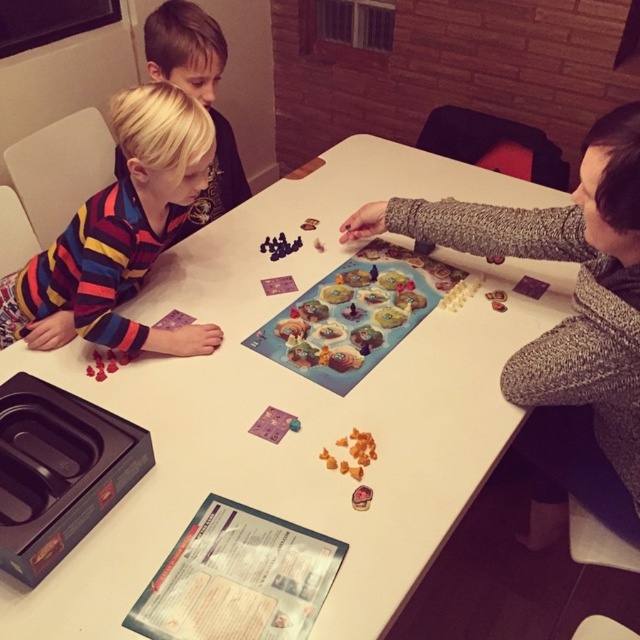
Question: Which point is farther to the camera?

Choices:
 (A) white glossy table at center
 (B) wooden board game at center
 (C) striped fabric shirt at left

Answer: (B)

Question: Which of the following is the farthest from the observer?

Choices:
 (A) coord(225,198)
 (B) coord(499,244)
 (C) coord(285,321)

Answer: (A)

Question: Considering the real-world distances, which object is farthest from the blonde hair at left?

Choices:
 (A) striped fabric shirt at left
 (B) matte gray sweater at upper right
 (C) wooden board game at center
 (D) white glossy table at center

Answer: (B)

Question: Does striped fabric shirt at left appear on the left side of wooden board game at center?

Choices:
 (A) no
 (B) yes

Answer: (B)

Question: Does white glossy table at center appear under blonde hair at left?

Choices:
 (A) no
 (B) yes

Answer: (B)

Question: Is matte gray sweater at upper right above blonde hair at left?

Choices:
 (A) no
 (B) yes

Answer: (A)